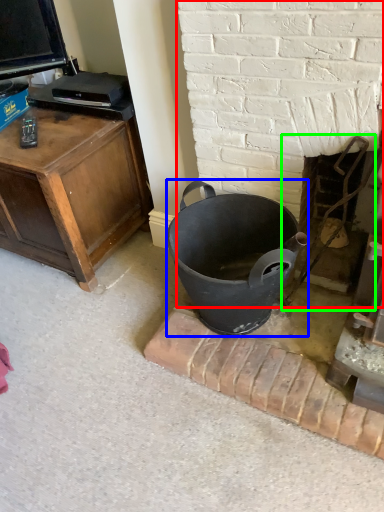
Question: Which is farther away from fireplace (highlighted by a red box)? trash bin/can (highlighted by a blue box) or fireplace (highlighted by a green box)?

Choices:
 (A) trash bin/can
 (B) fireplace

Answer: (A)